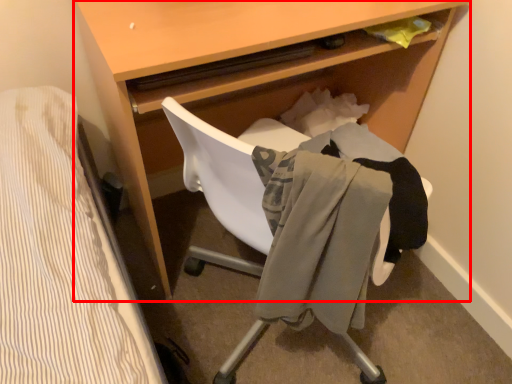
Question: Considering the relative positions of desk (annotated by the red box) and clothing in the image provided, where is desk (annotated by the red box) located with respect to the staircase?

Choices:
 (A) left
 (B) right

Answer: (A)